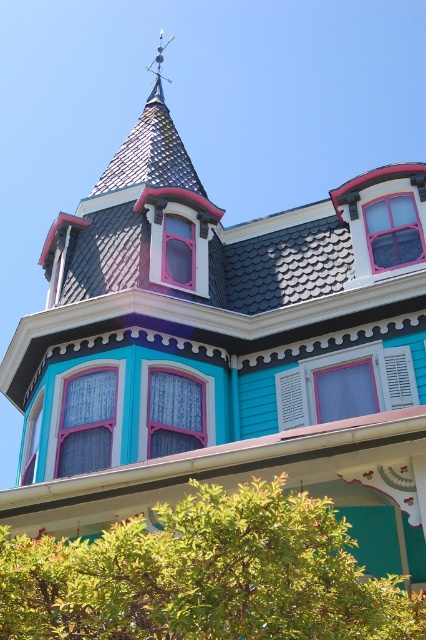
Question: Is green leafy tree at lower center in front of shiny metal spire at upper center?

Choices:
 (A) yes
 (B) no

Answer: (A)

Question: Can you confirm if green leafy tree at lower center is thinner than shiny metal spire at upper center?

Choices:
 (A) yes
 (B) no

Answer: (A)

Question: Is green leafy tree at lower center below shiny metal spire at upper center?

Choices:
 (A) yes
 (B) no

Answer: (A)